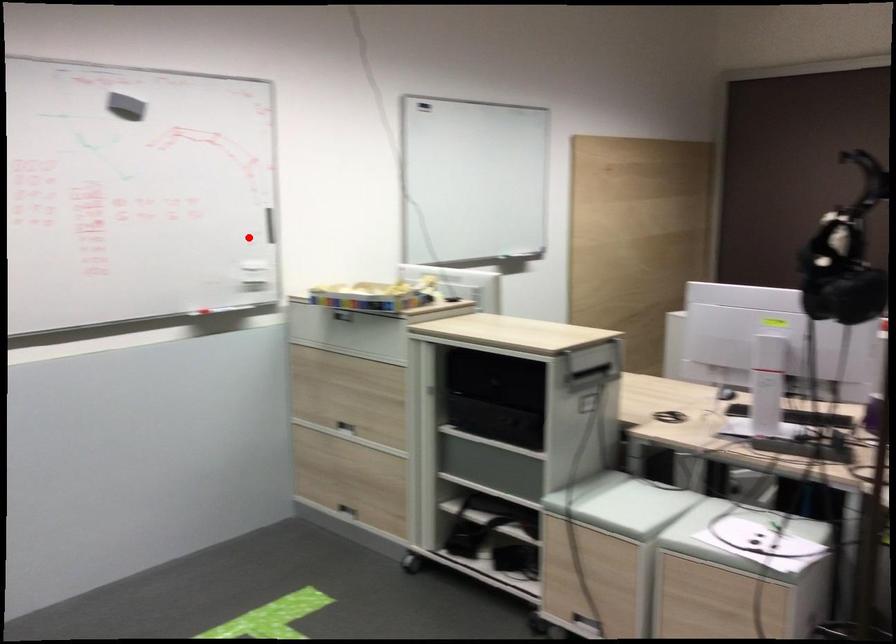
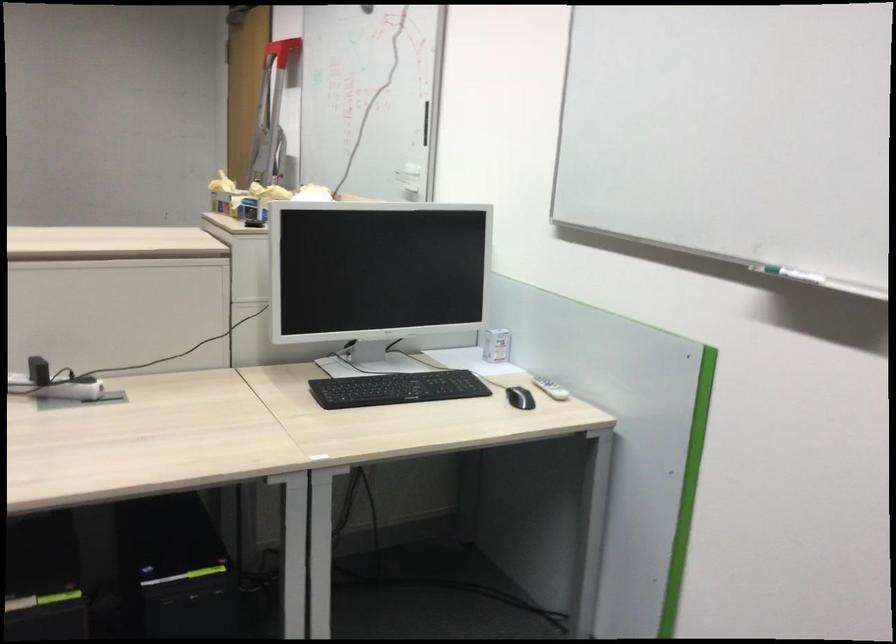
Find the pixel in the second image that matches the highlighted location in the first image.

(426, 122)